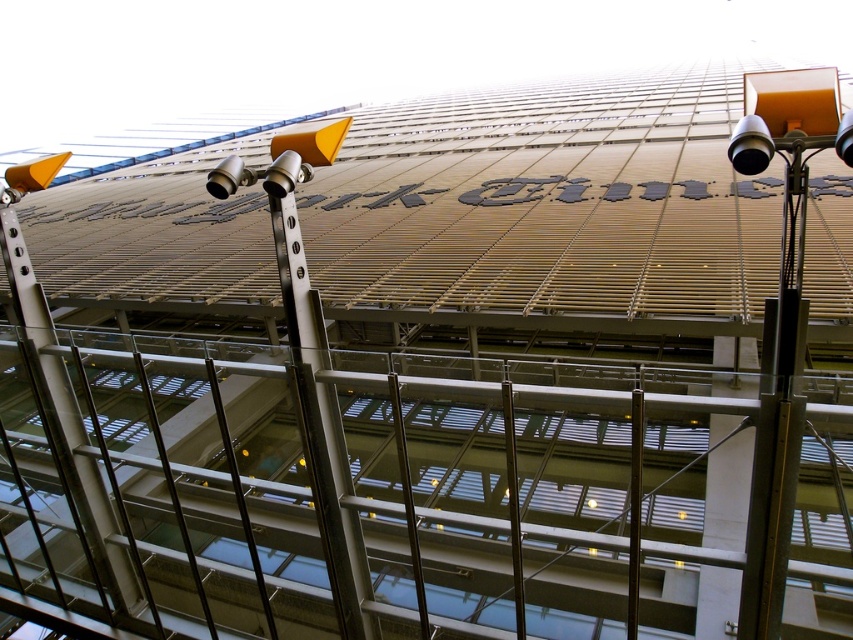
Between black metal pole at center and polished silver pole at center, which one appears on the right side from the viewer's perspective?

From the viewer's perspective, black metal pole at center appears more on the right side.

Can you confirm if black metal pole at center is taller than polished silver pole at center?

Incorrect, black metal pole at center's height is not larger of polished silver pole at center's.

Who is more distant from viewer, (631,561) or (515,540)?

Positioned behind is point (515,540).

Where is `black metal pole at center`? black metal pole at center is located at coordinates (634, 512).